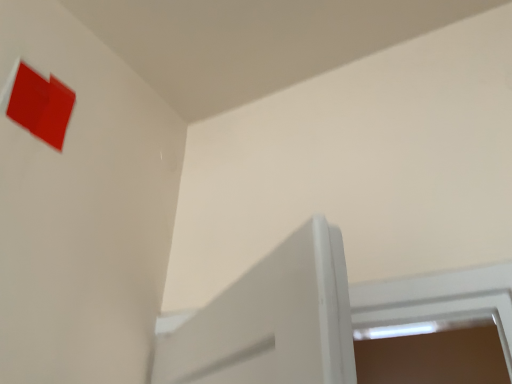
I want to click on matte red paper at upper left, so click(41, 105).

The image size is (512, 384). Describe the element at coordinates (41, 105) in the screenshot. I see `matte red paper at upper left` at that location.

Find the location of a particular element. matte red paper at upper left is located at coordinates (41, 105).